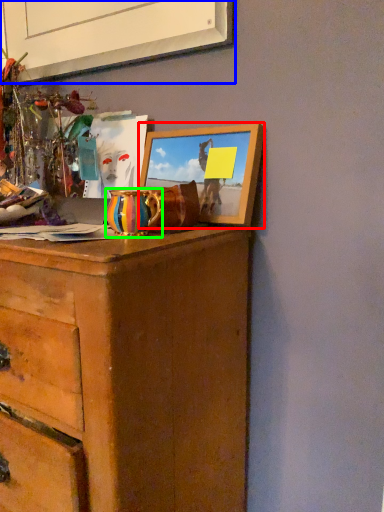
Question: Based on their relative distances, which object is nearer to picture frame (highlighted by a red box)? Choose from picture frame (highlighted by a blue box) and vase (highlighted by a green box).

Choices:
 (A) picture frame
 (B) vase

Answer: (B)